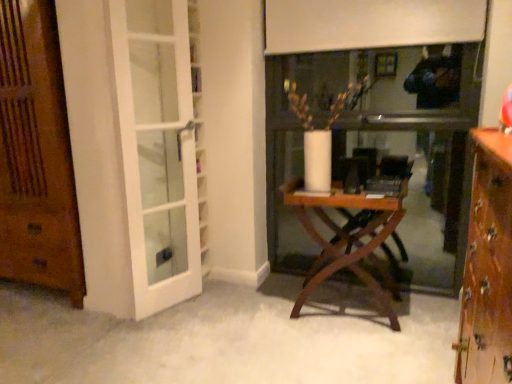
This screenshot has width=512, height=384. I want to click on free space in front of wooden folding table at center, so click(352, 348).